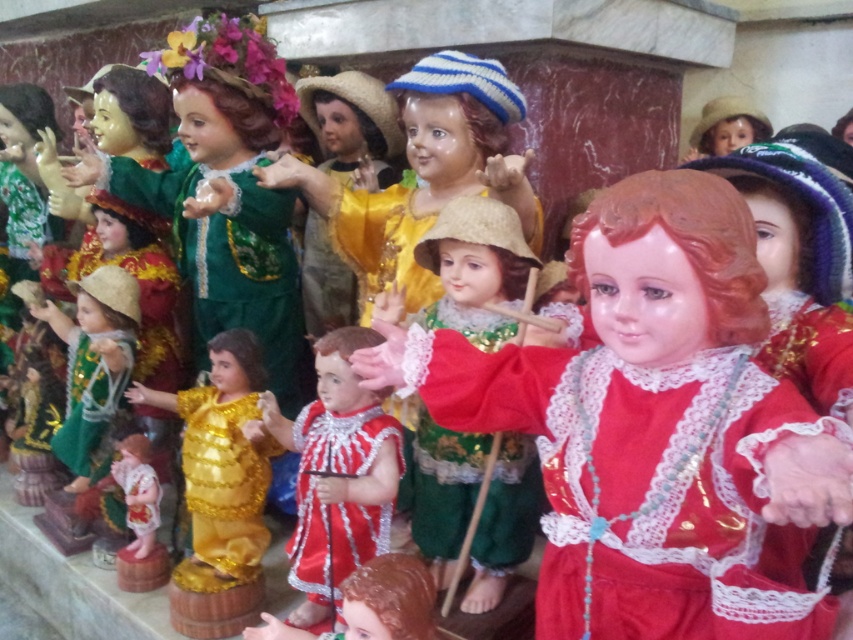
Question: Which of the following is the closest to the observer?

Choices:
 (A) (521, 515)
 (B) (546, 435)

Answer: (B)

Question: Which of the following is the farthest from the observer?

Choices:
 (A) (428, 502)
 (B) (549, 394)

Answer: (A)

Question: Can you confirm if shiny red porcelain doll at center is positioned to the left of shiny green fabric doll at center?

Choices:
 (A) yes
 (B) no

Answer: (B)

Question: Where is shiny red porcelain doll at center located in relation to shiny green fabric doll at center in the image?

Choices:
 (A) above
 (B) below

Answer: (A)

Question: Can you confirm if shiny red porcelain doll at center is positioned below shiny green fabric doll at center?

Choices:
 (A) yes
 (B) no

Answer: (B)